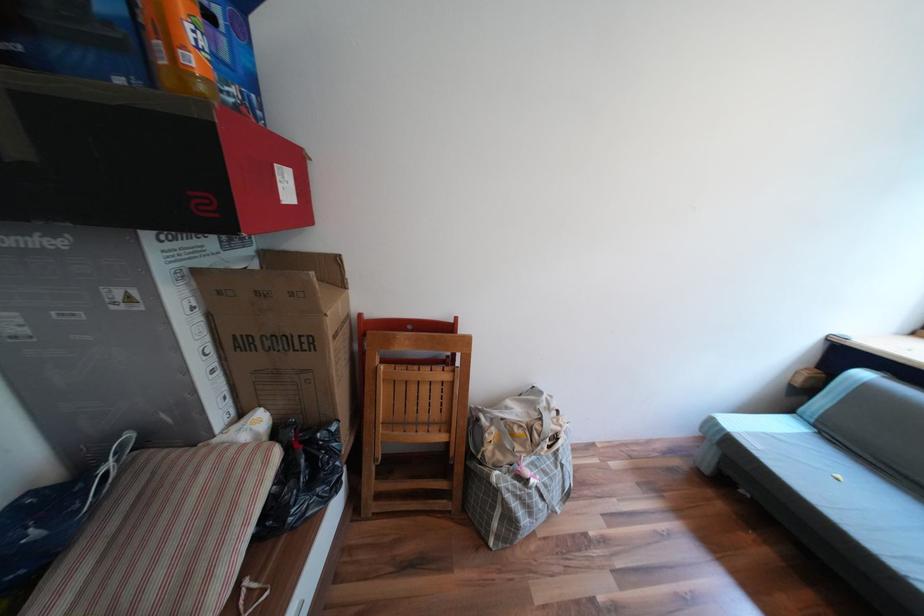
Identify the location of black plastic bag. Image resolution: width=924 pixels, height=616 pixels. (301, 477).